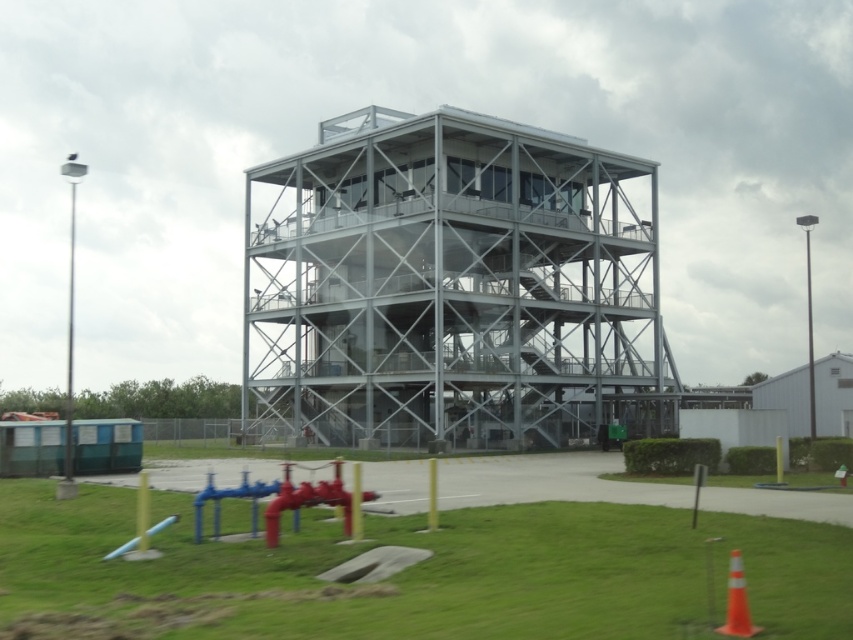
Question: Can you confirm if metallic structure at center is thinner than orange plastic cone at lower right?

Choices:
 (A) no
 (B) yes

Answer: (A)

Question: Which point is closer to the camera?

Choices:
 (A) metallic structure at center
 (B) orange plastic cone at lower right

Answer: (B)

Question: Is metallic structure at center smaller than orange plastic cone at lower right?

Choices:
 (A) no
 (B) yes

Answer: (A)

Question: In this image, where is metallic structure at center located relative to orange plastic cone at lower right?

Choices:
 (A) below
 (B) above

Answer: (B)